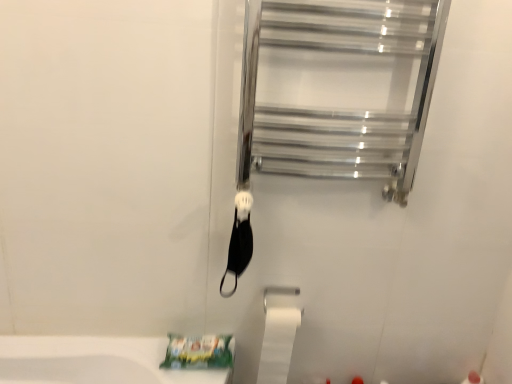
Question: Is point (397, 82) positioned closer to the camera than point (270, 350)?

Choices:
 (A) closer
 (B) farther

Answer: (A)

Question: In the image, is clear glass towel rack at upper right positioned in front of or behind white matte toilet paper at lower center?

Choices:
 (A) front
 (B) behind

Answer: (A)

Question: From a real-world perspective, is clear glass towel rack at upper right physically located above or below white matte toilet paper at lower center?

Choices:
 (A) above
 (B) below

Answer: (A)

Question: Considering the positions of point (282, 367) and point (357, 94), is point (282, 367) closer or farther from the camera than point (357, 94)?

Choices:
 (A) closer
 (B) farther

Answer: (B)

Question: Considering their positions, is white matte toilet paper at lower center located in front of or behind clear glass towel rack at upper right?

Choices:
 (A) behind
 (B) front

Answer: (A)

Question: Is white matte toilet paper at lower center to the left or to the right of clear glass towel rack at upper right in the image?

Choices:
 (A) right
 (B) left

Answer: (B)

Question: Would you say white matte toilet paper at lower center is inside or outside clear glass towel rack at upper right?

Choices:
 (A) outside
 (B) inside

Answer: (A)